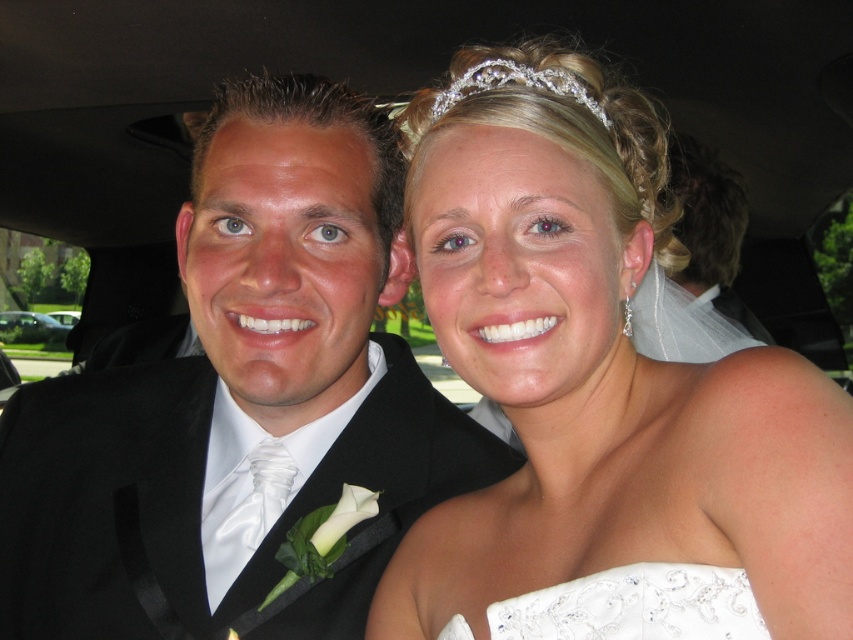
Between white satin dress at upper right and clear crystal tiara at upper center, which one is positioned higher?

clear crystal tiara at upper center is above.

Who is taller, white satin dress at upper right or clear crystal tiara at upper center?

white satin dress at upper right

Who is more forward, (733, 493) or (477, 72)?

Point (733, 493) is more forward.

You are a GUI agent. You are given a task and a screenshot of the screen. Output one action in this format:
    pyautogui.click(x=<x>, y=<y>)
    Task: Click on the white satin dress at upper right
    
    Given the screenshot: What is the action you would take?
    pyautogui.click(x=605, y=397)

Does white satin dress at upper right have a smaller size compared to white satin wedding dress at center?

No, white satin dress at upper right is not smaller than white satin wedding dress at center.

Who is more distant from viewer, (466, 172) or (553, 611)?

Point (466, 172)

Between point (630, 157) and point (537, 637), which one is positioned behind?

Positioned behind is point (630, 157).

Identify the location of white satin dress at upper right. The height and width of the screenshot is (640, 853). (605, 397).

Who is lower down, black satin tuxedo at left or white satin wedding dress at center?

white satin wedding dress at center is below.

Can you confirm if black satin tuxedo at left is thinner than white satin wedding dress at center?

No.

Is point (142, 417) less distant than point (595, 612)?

No, (142, 417) is behind (595, 612).

At what (x,y) coordinates should I click in order to perform the action: click on black satin tuxedo at left. Please return your answer as a coordinate pair (x, y). Image resolution: width=853 pixels, height=640 pixels. Looking at the image, I should click on coord(242,403).